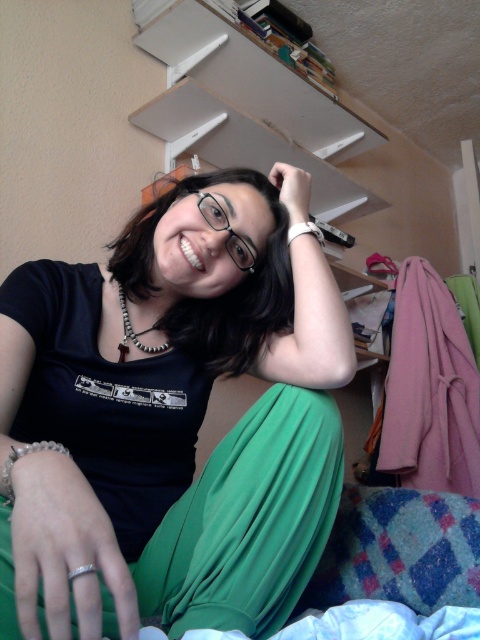
Consider the image. Based on the scene description, can you determine the relative position of the white matte bookshelf at upper center and the white leather bracelet at upper center?

The white matte bookshelf at upper center is located to the right of the white leather bracelet at upper center.